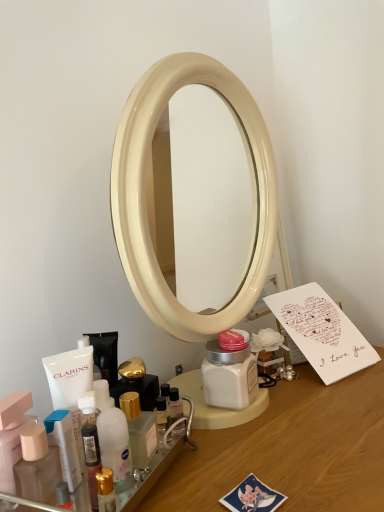
I want to click on unoccupied region to the right of matte plastic bottle at lower left, which is the second toiletry from left to right, so click(206, 470).